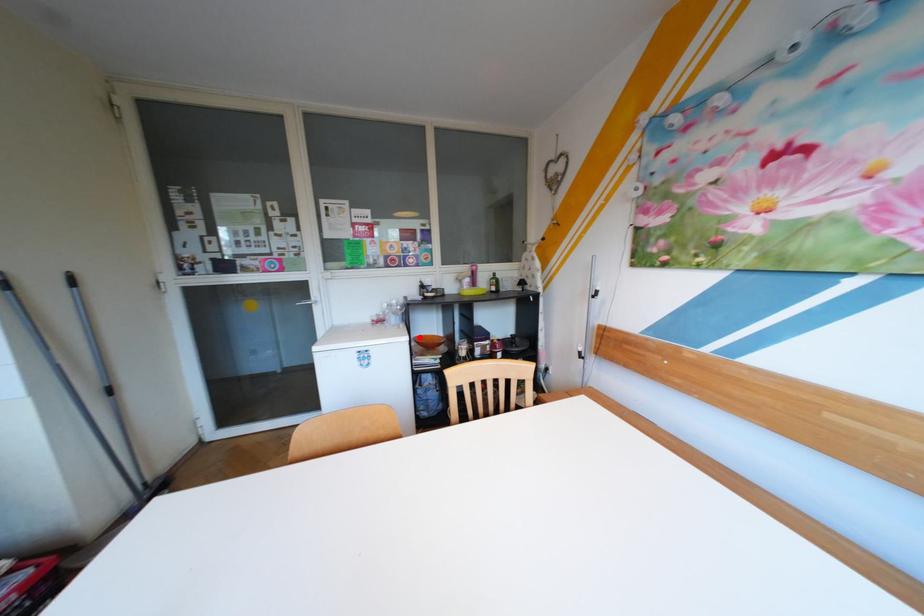
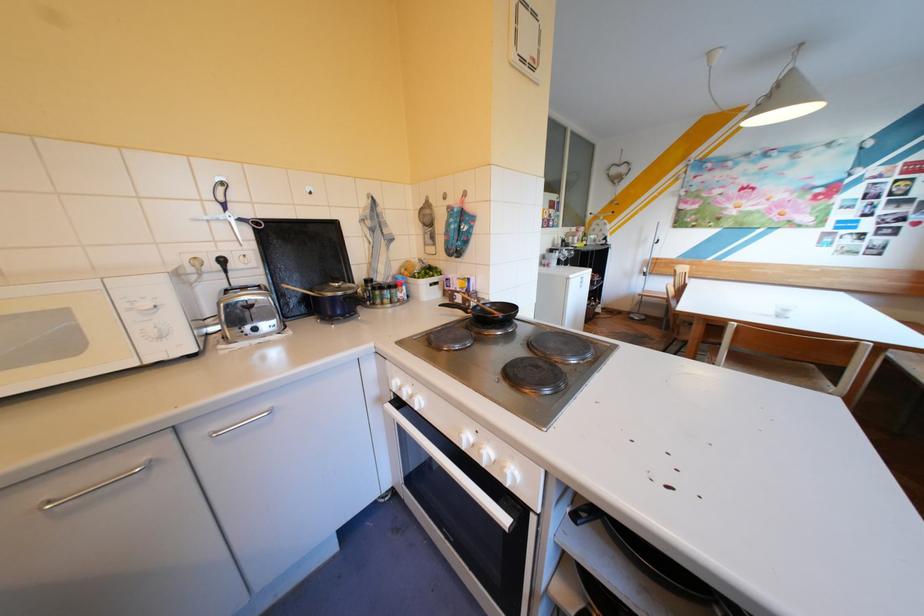
Question: I am providing you with two images of the same scene from different viewpoints. A red point is marked on the first image. At the location where the point appears in image 1, is it still visible in image 2?

Choices:
 (A) Yes
 (B) No

Answer: (B)